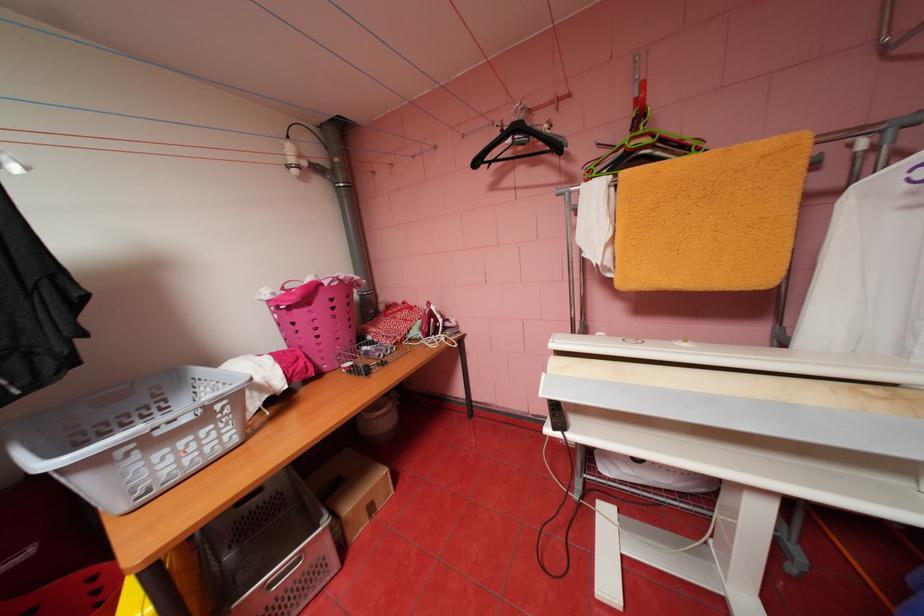
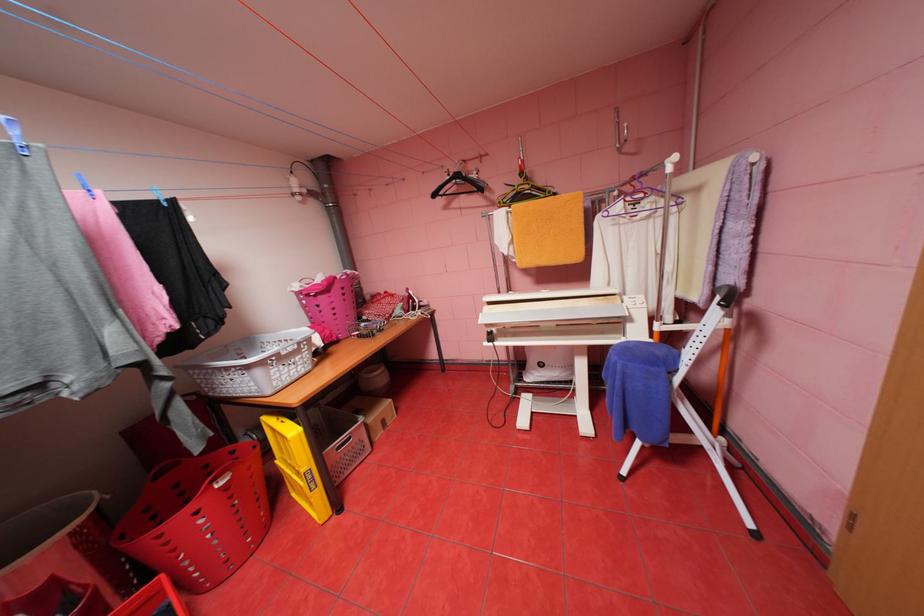
Question: In a continuous first-person perspective shot, in which direction is the camera moving?

Choices:
 (A) Left
 (B) Right
 (C) Forward
 (D) Backward

Answer: (D)